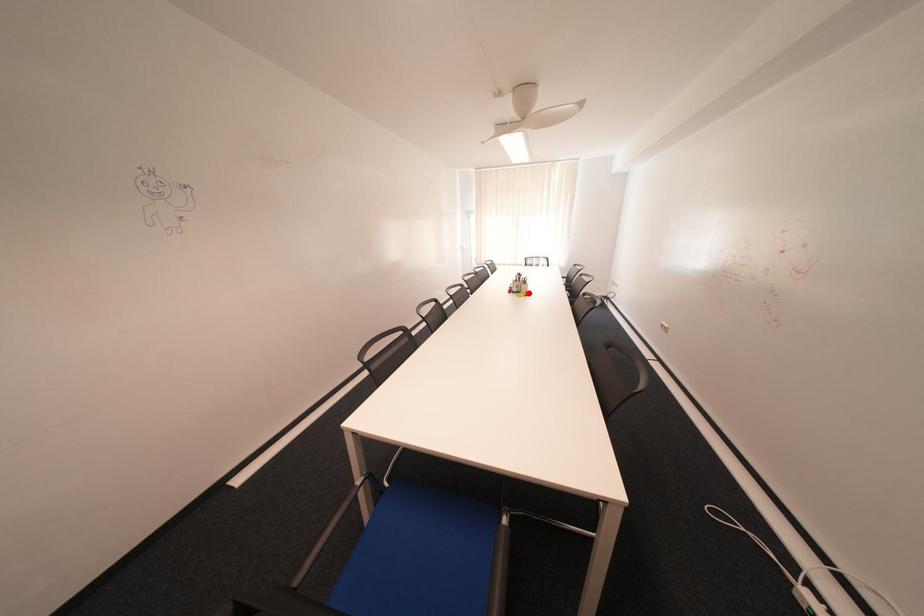
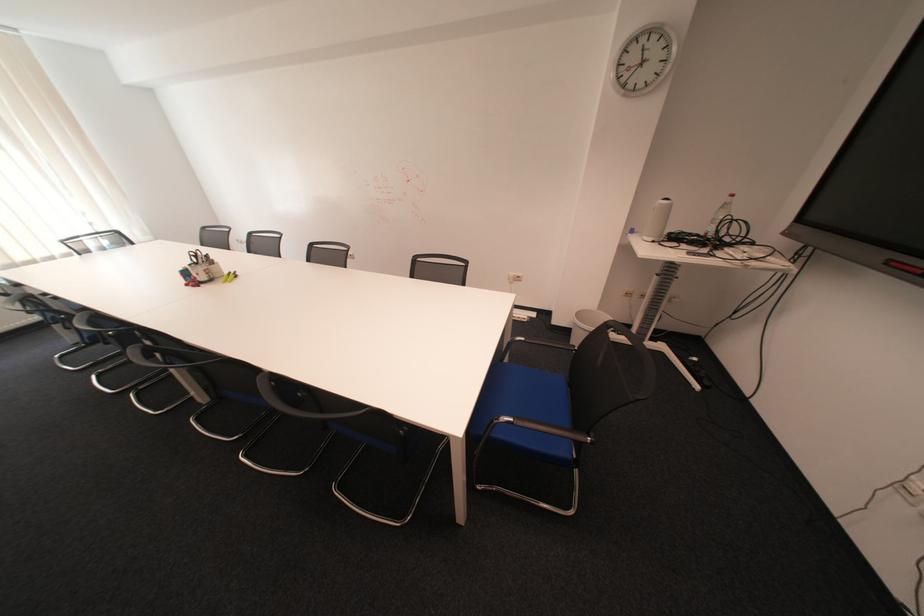
In the second image, find the point that corresponds to the highlighted location in the first image.

(223, 281)